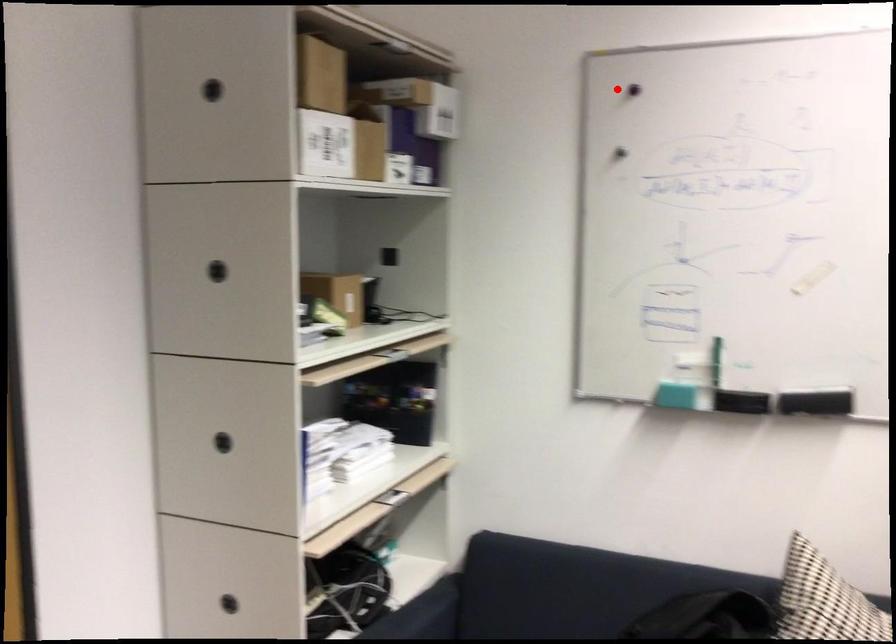
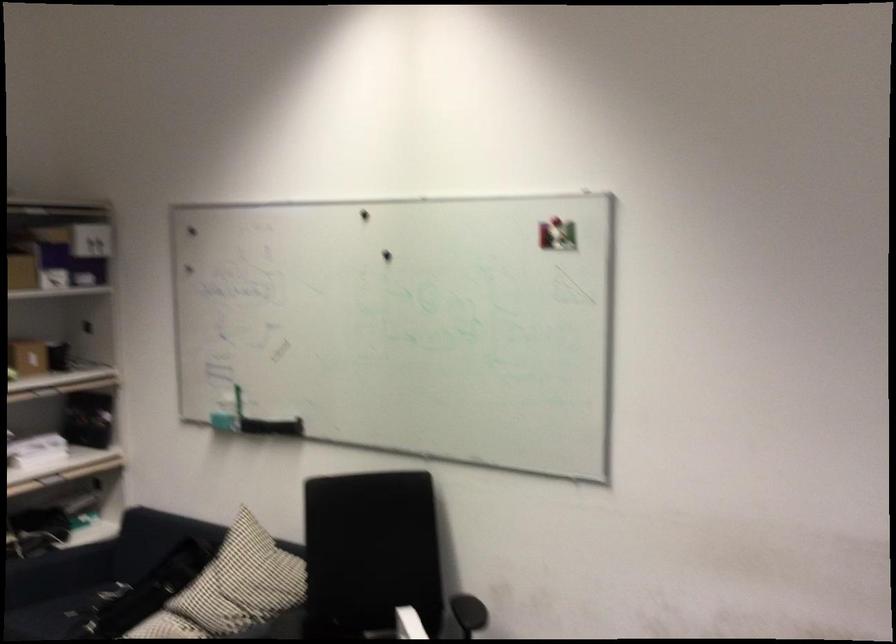
Question: I am providing you with two images of the same scene from different viewpoints. A red point is shown in image1. For the corresponding object point in image2, is it positioned nearer or farther from the camera?

Choices:
 (A) Nearer
 (B) Farther

Answer: (B)